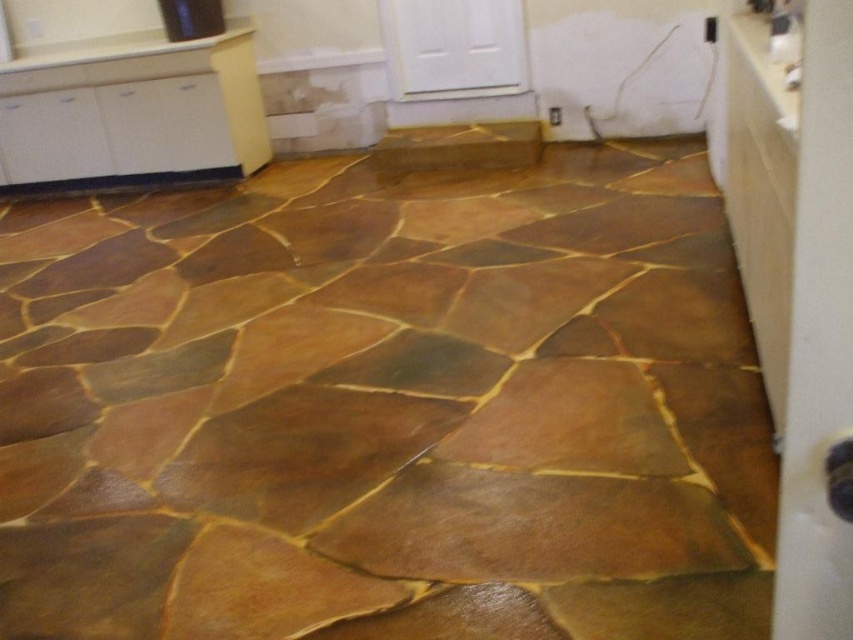
You are a contractor working on this room. You need to install a new electrical outlet. The outlet requires a flat surface to be mounted. Which object between the brown polished stone at center and the white glossy counter top at upper left would be more suitable for this task? Please explain your choice based on their positions and the scene description.

The white glossy counter top at upper left is more suitable for mounting the electrical outlet because it is positioned above the brown polished stone at center and likely provides a flat surface. The scene mentions the room is under renovation with exposed electrical wiring nearby, making the counter top a logical choice for installation.

You are a contractor working on the renovation of this room. You need to install a new light fixture between the white glossy counter top at upper right and the white glossy counter top at upper left. Based on their positions, which counter top is closer to the ceiling?

The white glossy counter top at upper left is closer to the ceiling because it is above the white glossy counter top at upper right, which is located below it.